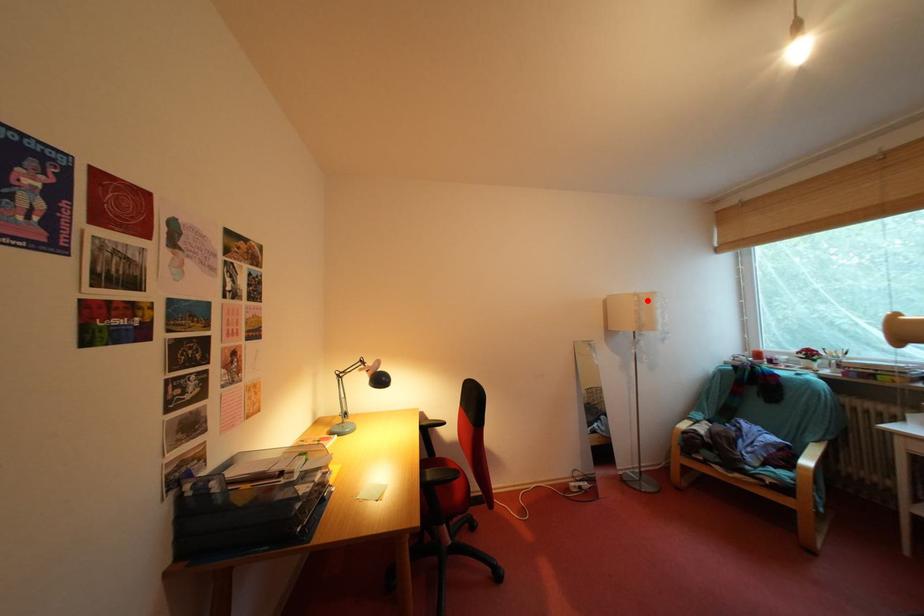
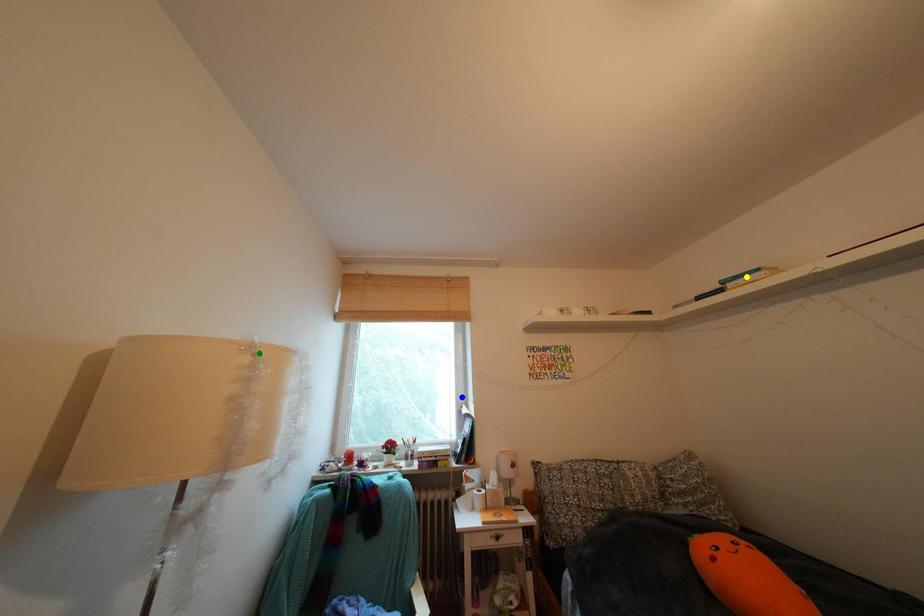
Question: I am providing you with two images of the same scene from different viewpoints. A red point is marked on the first image. You are given multiple points on the second image. Which spot in image 2 lines up with the point in image 1?

Choices:
 (A) blue point
 (B) green point
 (C) yellow point

Answer: (B)